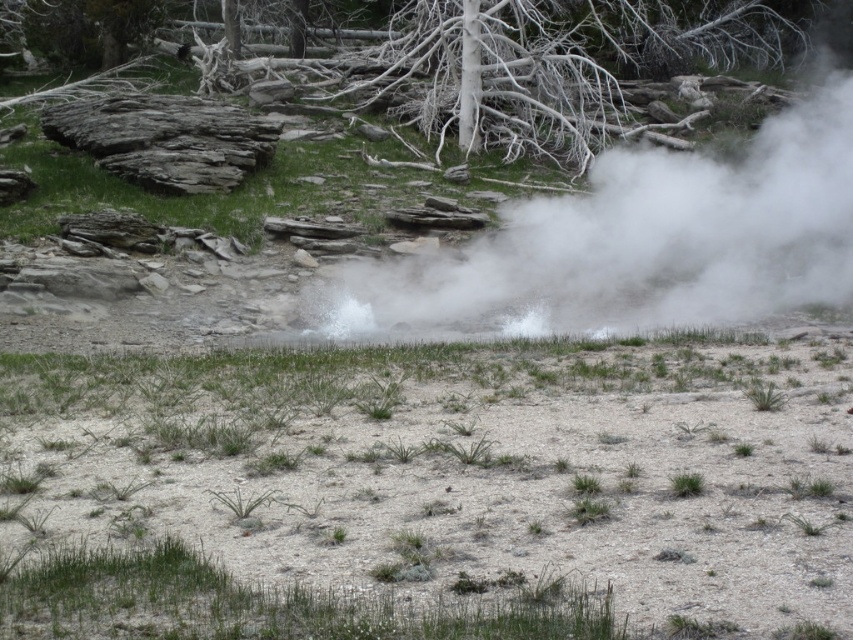
Can you confirm if dull brown dirt at center is positioned above white bark tree at upper center?

Incorrect, dull brown dirt at center is not positioned above white bark tree at upper center.

Does point (645, 632) lie behind point (462, 68)?

No, (645, 632) is closer to viewer.

The height and width of the screenshot is (640, 853). In order to click on dull brown dirt at center in this screenshot , I will do `click(428, 492)`.

Is white vapor steam at center taller than white bark tree at upper center?

Correct, white vapor steam at center is much taller as white bark tree at upper center.

Does point (589, 298) lie behind point (695, 10)?

No, it is not.

Is point (769, 116) positioned behind point (514, 138)?

Yes, it is.

The image size is (853, 640). I want to click on white vapor steam at center, so [x=631, y=246].

Between dull brown dirt at center and white vapor steam at center, which one is positioned lower?

dull brown dirt at center is lower down.

Does dull brown dirt at center lie behind white vapor steam at center?

That is False.

Is point (426, 444) positioned after point (808, 257)?

No, (426, 444) is in front of (808, 257).

Where is `dull brown dirt at center`? The image size is (853, 640). dull brown dirt at center is located at coordinates (428, 492).